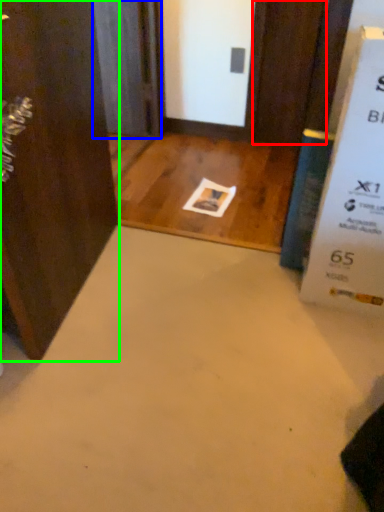
Question: Which object is the closest to the door (highlighted by a red box)? Choose among these: screen door (highlighted by a blue box) or door (highlighted by a green box).

Choices:
 (A) screen door
 (B) door

Answer: (A)